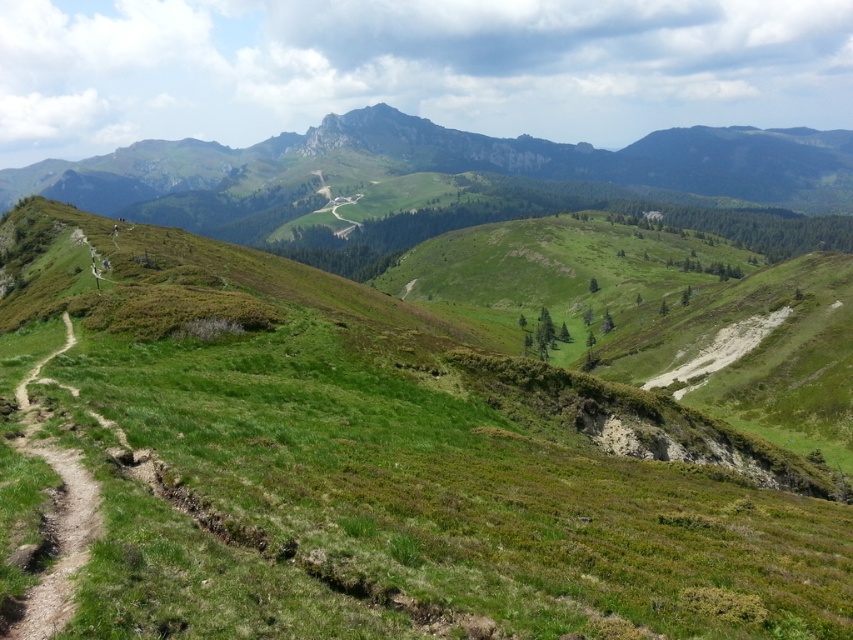
You are planning to set up a tent for a camping trip and have two options for locations. One is on the green grassy hill at upper center, and the other is near the dirt path at left. Considering the terrain described in the scene, which location would provide a more stable and level surface for setting up the tent?

The dirt path at left is more stable and level for setting up the tent because the green grassy hill at upper center has patches of brown earth indicating a rugged terrain, while the dirt path is well trodden and likely smoother.

You are standing at the starting point of the dirt path in the foreground and want to reach the distant mountain peak. Which of the two points, point (368, 243) or point (62, 564), is closer to your current position?

Point (368, 243) is closer to your current position because it is further to the viewer than point (62, 564), which is farther away.